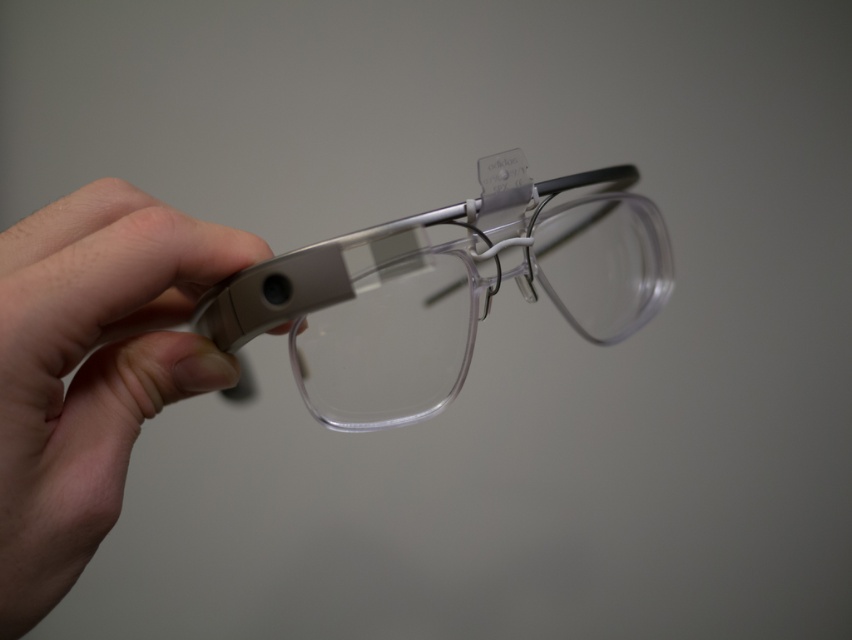
Question: From the image, what is the correct spatial relationship of skin tone flesh hand at left in relation to clear plastic glasses at center?

Choices:
 (A) above
 (B) below

Answer: (B)

Question: Can you confirm if skin tone flesh hand at left is bigger than clear plastic glasses at center?

Choices:
 (A) yes
 (B) no

Answer: (B)

Question: Does skin tone flesh hand at left have a smaller size compared to clear plastic glasses at center?

Choices:
 (A) yes
 (B) no

Answer: (A)

Question: Among these points, which one is farthest from the camera?

Choices:
 (A) tap(323, 352)
 (B) tap(16, 230)

Answer: (A)

Question: Which point is farther to the camera?

Choices:
 (A) clear plastic glasses at center
 (B) skin tone flesh hand at left

Answer: (A)